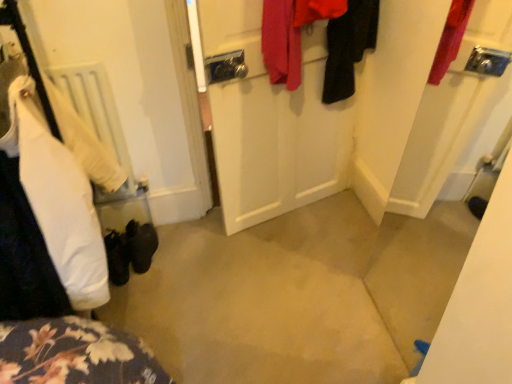
Question: Is white matte door at center outside of black fabric coat at upper right, the third clothing viewed from the left?

Choices:
 (A) no
 (B) yes

Answer: (B)

Question: From the image's perspective, is white matte door at center on black fabric coat at upper right, the third clothing viewed from the left?

Choices:
 (A) yes
 (B) no

Answer: (B)

Question: From the image's perspective, would you say white matte door at center is shown under black fabric coat at upper right, which ranks as the 1th clothing in right-to-left order?

Choices:
 (A) yes
 (B) no

Answer: (A)

Question: Can you confirm if white matte door at center is smaller than black fabric coat at upper right, the third clothing viewed from the left?

Choices:
 (A) no
 (B) yes

Answer: (A)

Question: Is white matte door at center next to black fabric coat at upper right, which ranks as the 1th clothing in right-to-left order, and touching it?

Choices:
 (A) yes
 (B) no

Answer: (B)

Question: Is black suede shoes at lower left bigger or smaller than white matte radiator at left?

Choices:
 (A) big
 (B) small

Answer: (B)

Question: From their relative heights in the image, would you say black suede shoes at lower left is taller or shorter than white matte radiator at left?

Choices:
 (A) short
 (B) tall

Answer: (A)

Question: Considering the positions of black suede shoes at lower left and white matte radiator at left in the image, is black suede shoes at lower left wider or thinner than white matte radiator at left?

Choices:
 (A) wide
 (B) thin

Answer: (A)

Question: From the image's perspective, is black suede shoes at lower left positioned above or below white matte radiator at left?

Choices:
 (A) below
 (B) above

Answer: (A)

Question: Does point (256, 137) appear closer or farther from the camera than point (344, 66)?

Choices:
 (A) farther
 (B) closer

Answer: (A)

Question: Is white matte door at center wider or thinner than black fabric coat at upper right, the third clothing viewed from the left?

Choices:
 (A) thin
 (B) wide

Answer: (A)

Question: From a real-world perspective, relative to black fabric coat at upper right, which ranks as the 1th clothing in right-to-left order, is white matte door at center vertically above or below?

Choices:
 (A) below
 (B) above

Answer: (A)

Question: Is white matte door at center to the left or to the right of black fabric coat at upper right, which ranks as the 1th clothing in right-to-left order, in the image?

Choices:
 (A) right
 (B) left

Answer: (B)

Question: Considering the positions of black fabric coat at upper right, the third clothing viewed from the left, and white matte radiator at left in the image, is black fabric coat at upper right, the third clothing viewed from the left, wider or thinner than white matte radiator at left?

Choices:
 (A) wide
 (B) thin

Answer: (A)

Question: Looking at the image, does black fabric coat at upper right, the third clothing viewed from the left, seem bigger or smaller compared to white matte radiator at left?

Choices:
 (A) small
 (B) big

Answer: (A)